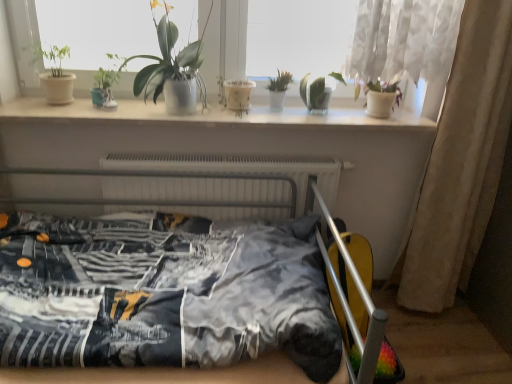
What are the coordinates of `vacant area situated to the left side of matte white flowerpot at center` in the screenshot? It's located at (200, 107).